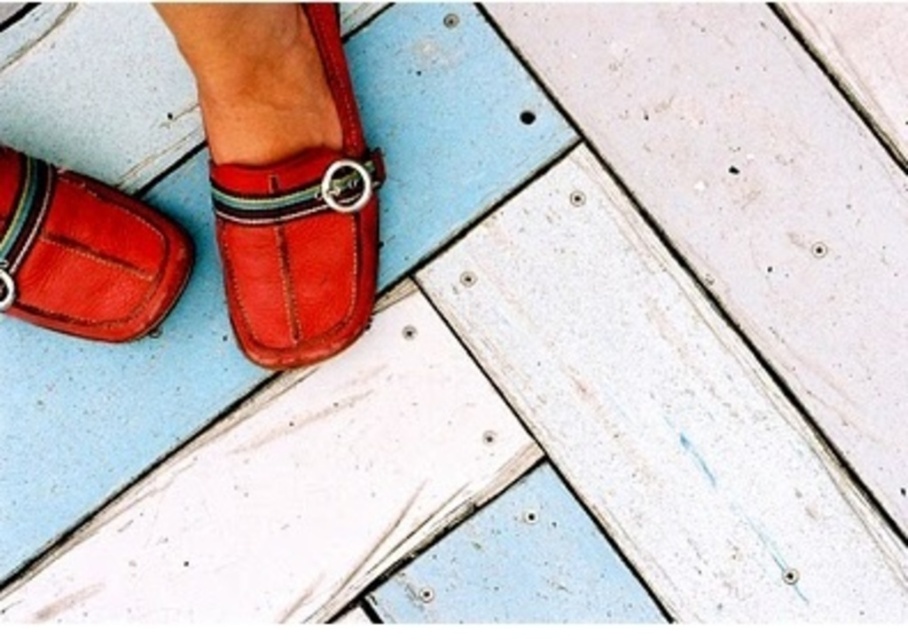
Question: Observing the image, what is the correct spatial positioning of leather loafer at center in reference to matte leather shoe at lower left?

Choices:
 (A) right
 (B) left

Answer: (A)

Question: Does leather loafer at center have a lesser width compared to matte leather shoe at lower left?

Choices:
 (A) no
 (B) yes

Answer: (A)

Question: Among these points, which one is farthest from the camera?

Choices:
 (A) (45, 196)
 (B) (348, 97)

Answer: (B)

Question: Which point appears farthest from the camera in this image?

Choices:
 (A) (107, 307)
 (B) (262, 348)

Answer: (B)

Question: Does leather loafer at center have a greater width compared to matte leather shoe at lower left?

Choices:
 (A) no
 (B) yes

Answer: (B)

Question: Among these points, which one is nearest to the camera?

Choices:
 (A) pos(183,24)
 (B) pos(104,273)

Answer: (A)